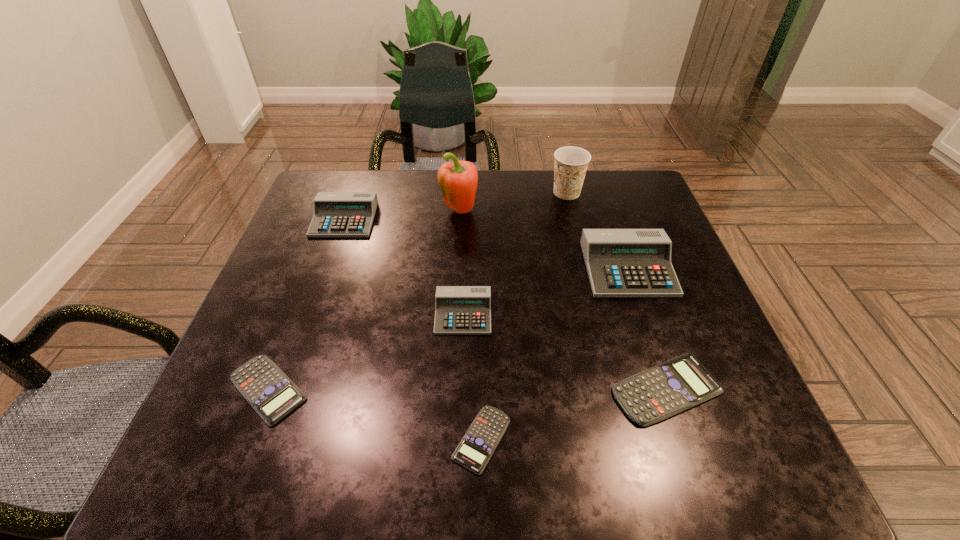
Image resolution: width=960 pixels, height=540 pixels. I want to click on the biggest blue calculator, so click(665, 390).

Where is `the third shortest object`? Image resolution: width=960 pixels, height=540 pixels. the third shortest object is located at coordinates (665, 390).

Locate an element on the screen. The height and width of the screenshot is (540, 960). the leftmost blue calculator is located at coordinates (271, 393).

You are a GUI agent. You are given a task and a screenshot of the screen. Output one action in this format:
    pyautogui.click(x=<x>, y=<y>)
    Task: Click on the second biggest blue calculator
    
    Given the screenshot: What is the action you would take?
    pyautogui.click(x=271, y=393)

Identify the location of the smallest blue calculator. The image size is (960, 540). (475, 449).

The width and height of the screenshot is (960, 540). I want to click on the second blue calculator from left to right, so click(x=475, y=449).

You are a GUI agent. You are given a task and a screenshot of the screen. Output one action in this format:
    pyautogui.click(x=<x>, y=<y>)
    Task: Click on the vacant space located on the left of the tallest object
    Image resolution: width=960 pixels, height=540 pixels.
    Given the screenshot: What is the action you would take?
    pyautogui.click(x=354, y=213)

At what (x,y) coordinates should I click in order to perform the action: click on free space located 0.160m on the right of the orange Dixie cup. Please return your answer as a coordinate pair (x, y). This screenshot has width=960, height=540. Looking at the image, I should click on (640, 192).

You are a GUI agent. You are given a task and a screenshot of the screen. Output one action in this format:
    pyautogui.click(x=<x>, y=<y>)
    Task: Click on the vacant space situated on the back of the biggest gray calculator
    The width and height of the screenshot is (960, 540).
    Given the screenshot: What is the action you would take?
    pyautogui.click(x=601, y=188)

Image resolution: width=960 pixels, height=540 pixels. I want to click on free space located 0.160m on the right of the leftmost gray calculator, so click(x=435, y=220).